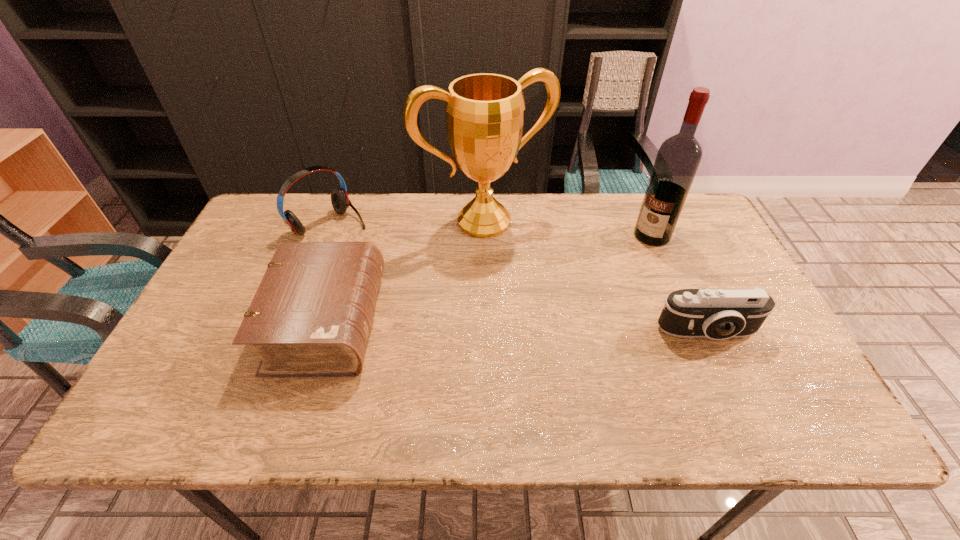
The width and height of the screenshot is (960, 540). I want to click on Bible, so click(311, 316).

Where is `camera`? This screenshot has height=540, width=960. camera is located at coordinates (718, 314).

What are the coordinates of `the third shortest object` in the screenshot? It's located at (340, 201).

At what (x,y) coordinates should I click in order to perform the action: click on the third object from right to left. Please return your answer as a coordinate pair (x, y). The width and height of the screenshot is (960, 540). Looking at the image, I should click on (484, 112).

The image size is (960, 540). In order to click on alcohol in this screenshot , I will do `click(678, 158)`.

Image resolution: width=960 pixels, height=540 pixels. I want to click on vacant region located on the spine side of the Bible, so click(x=514, y=323).

At what (x,y) coordinates should I click in order to perform the action: click on vacant space situated on the front lens of the camera. Please return your answer as a coordinate pair (x, y). This screenshot has width=960, height=540. Looking at the image, I should click on (734, 391).

The height and width of the screenshot is (540, 960). What are the coordinates of `free space located with the microphone attached to the side of the headset` in the screenshot? It's located at (424, 291).

Find the location of `vacant space located with the microphone attached to the side of the headset`. vacant space located with the microphone attached to the side of the headset is located at coordinates click(390, 265).

The height and width of the screenshot is (540, 960). Find the location of `vacant point located 0.290m with the microphone attached to the side of the headset`. vacant point located 0.290m with the microphone attached to the side of the headset is located at coordinates (415, 284).